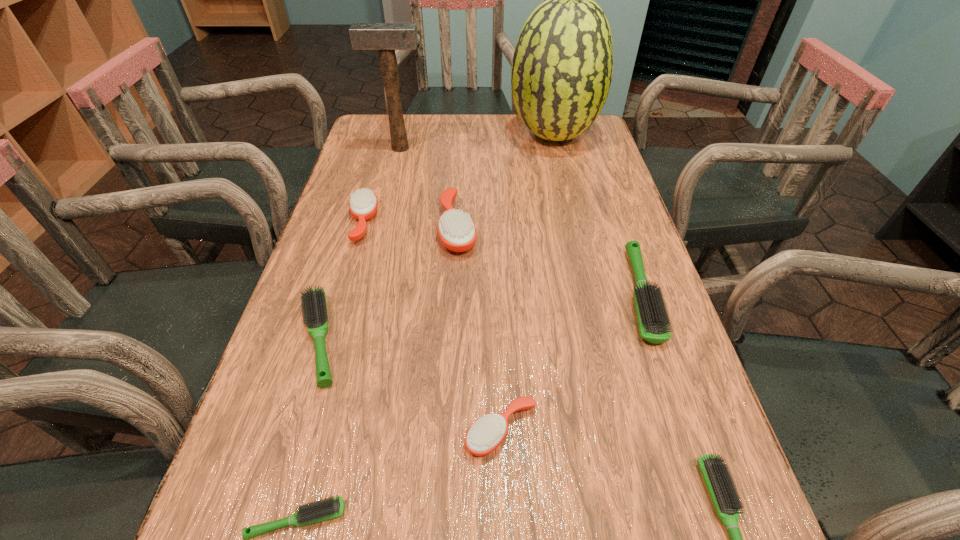
Where is `green watermelon`? This screenshot has width=960, height=540. green watermelon is located at coordinates (562, 66).

Image resolution: width=960 pixels, height=540 pixels. In order to click on mallet in this screenshot , I will do `click(386, 37)`.

This screenshot has height=540, width=960. I want to click on the biggest orange hairbrush, so click(457, 232).

Locate an element on the screen. the tallest hairbrush is located at coordinates (457, 232).

Where is `the leftmost orange hairbrush`? the leftmost orange hairbrush is located at coordinates (363, 204).

What are the coordinates of `the biggest light hairbrush` in the screenshot? It's located at (652, 318).

I want to click on the second biggest light hairbrush, so click(313, 300).

Identify the location of the nearest orange hairbrush. (487, 433).

You are a GUI agent. You are given a task and a screenshot of the screen. Output one action in this format:
    pyautogui.click(x=<x>, y=<y>)
    Task: Click on the vacant space located on the left of the green watermelon
    
    Given the screenshot: What is the action you would take?
    pyautogui.click(x=381, y=135)

This screenshot has height=540, width=960. What are the coordinates of `free region located on the right of the mallet` in the screenshot? It's located at (516, 148).